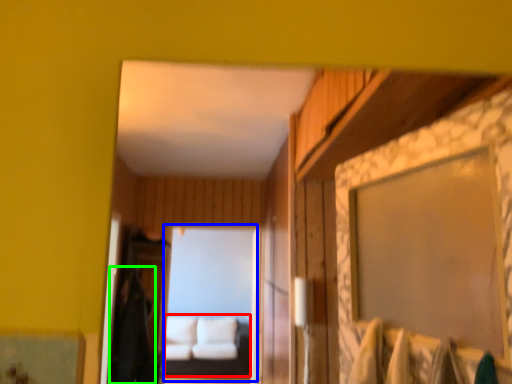
Question: Which is nearer to the couch (highlighted by a red box)? mirror (highlighted by a blue box) or robe (highlighted by a green box).

Choices:
 (A) mirror
 (B) robe

Answer: (A)